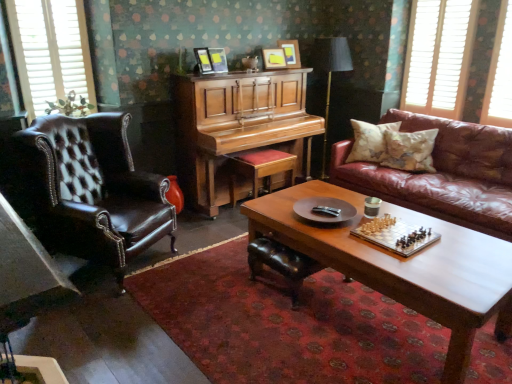
Where is `empty space that is ontop of wooden polished coffee table at center (from a real-world perspective)`? empty space that is ontop of wooden polished coffee table at center (from a real-world perspective) is located at coordinates (406, 256).